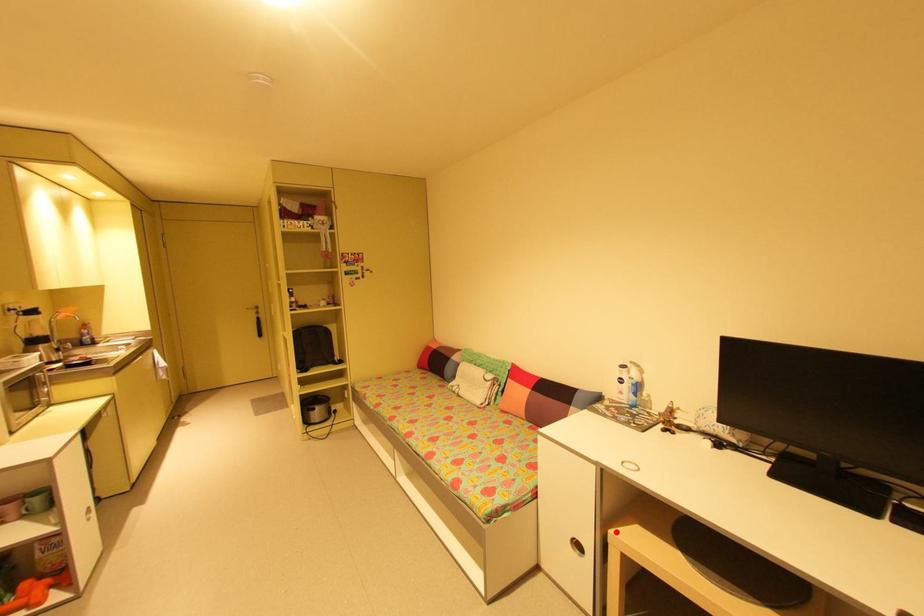
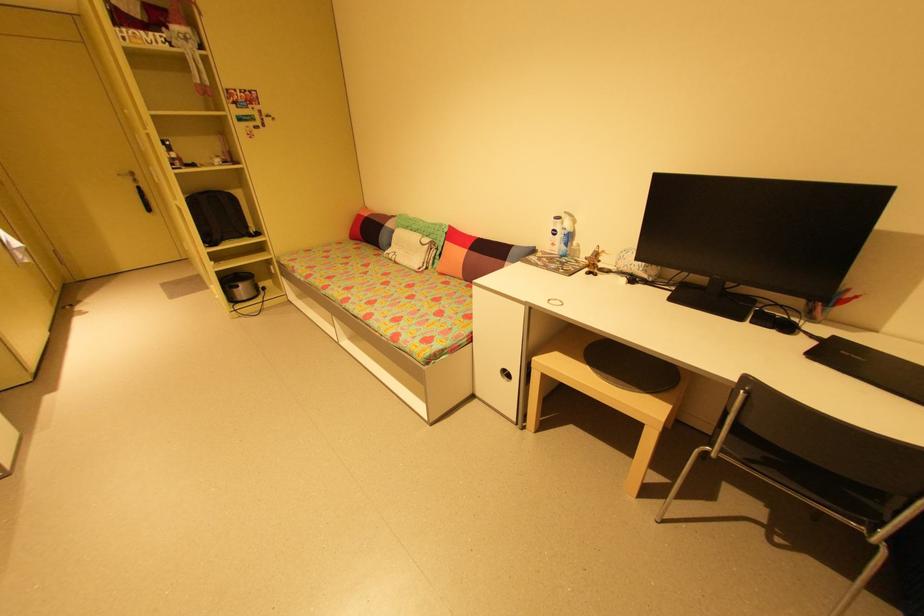
Question: I am providing you with two images of the same scene from different viewpoints. A red point is shown in image1. For the corresponding object point in image2, is it positioned nearer or farther from the camera?

Choices:
 (A) Nearer
 (B) Farther

Answer: (A)